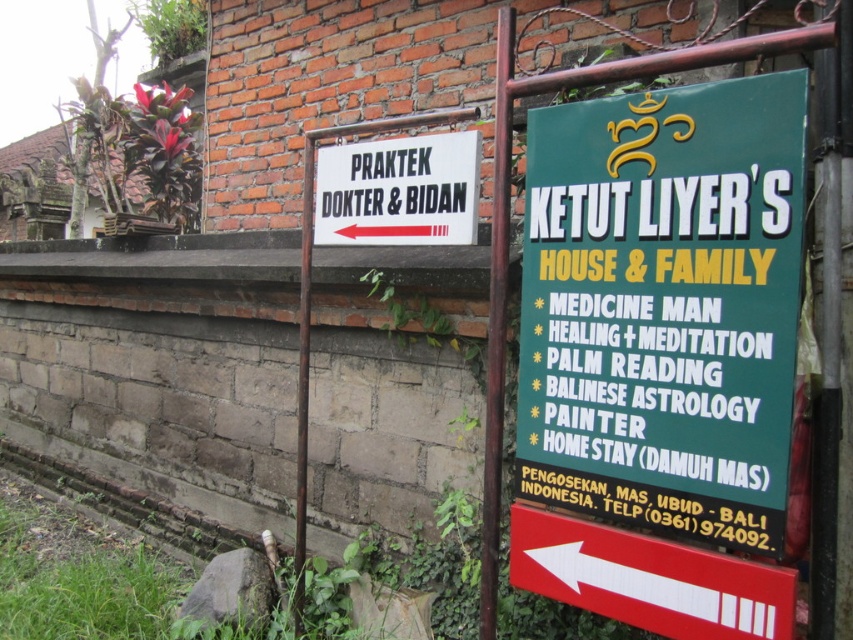
You are standing in front of two signs on a brick wall in Ubud, Bali. You see the white paper sign at left and the white matte sign at left. Which one is nearer to you?

The white paper sign at left is closer to the viewer than the white matte sign at left.

You are standing in front of a brick wall in Ubud, Bali, where you see a green matte signboard at upper right and a white paper sign at left. Which sign has a greater width?

The white paper sign at left has a greater width than the green matte signboard at upper right because the green matte signboard at upper right is thinner than the white paper sign at left.